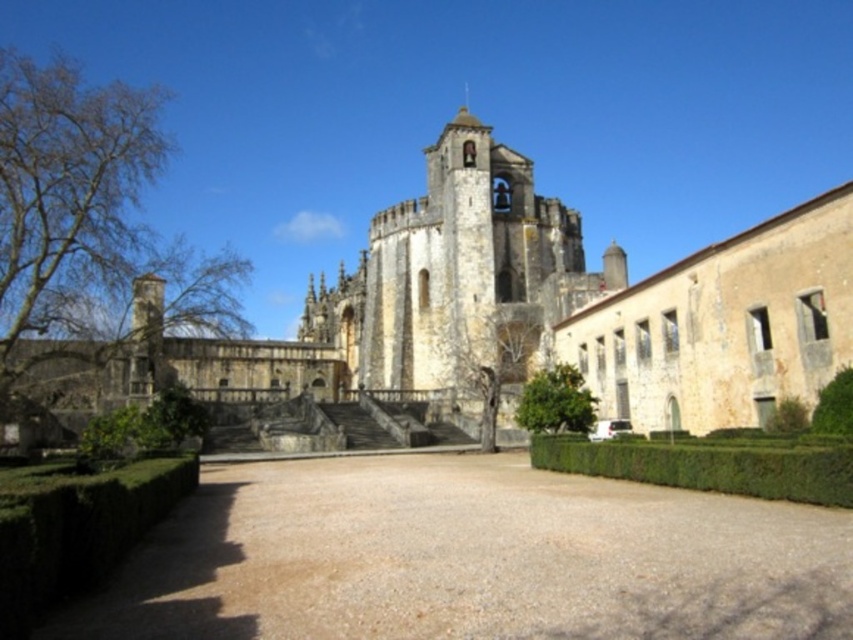
You are a gardener planning to plant a new row of flowers along the edge of the brown gravel driveway at center and the green leafy hedge at lower left. Which object should you place the flowers closer to if you want them to be in a sunnier spot?

The flowers should be placed closer to the brown gravel driveway at center because it is shorter than the green leafy hedge at lower left, which might block sunlight.

You are standing in the courtyard in front of the light beige stone church at center and notice the bare branches at left. If you want to take a photo that includes both the church and the branches, which object should you position closer to the edge of the frame to ensure both fit in the shot?

You should position the bare branches at left closer to the edge of the frame since their width is smaller than the light beige stone church at center, allowing them to fit within the shot while still capturing the church.

You are standing in the courtyard and want to walk towards the historic building. Which path should you take, the brown gravel driveway at center or the green leafy hedge at lower left, to get closer to the building?

You should take the brown gravel driveway at center because it is closer to you than the green leafy hedge at lower left, so walking towards it will bring you nearer to the historic building.